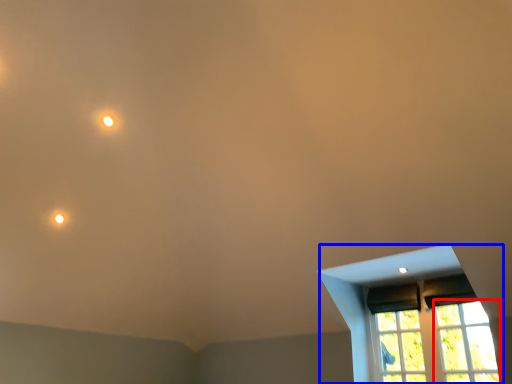
Question: Which point is closer to the camera, glass window (highlighted by a red box) or window (highlighted by a blue box)?

Choices:
 (A) glass window
 (B) window

Answer: (A)